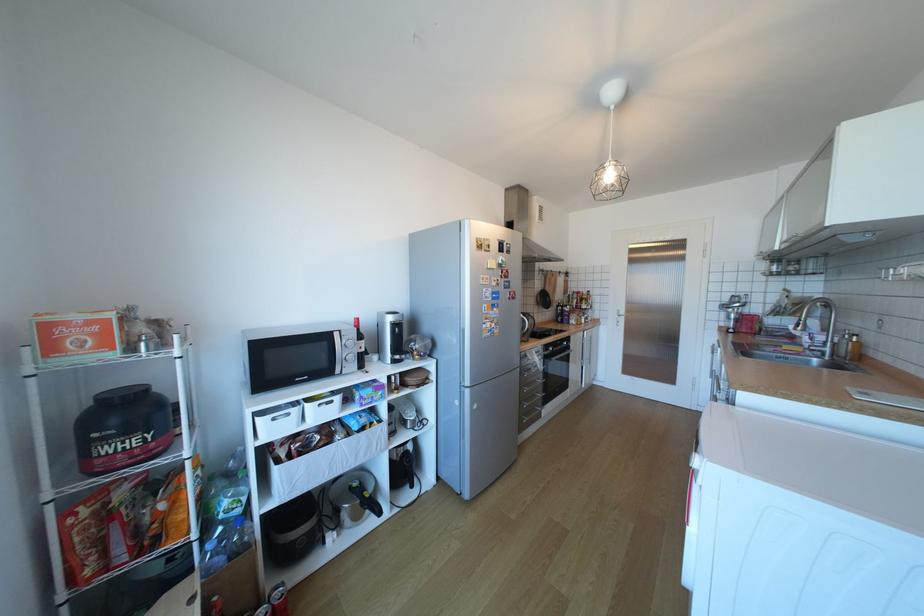
What do you see at coordinates (622, 314) in the screenshot?
I see `the white door handle` at bounding box center [622, 314].